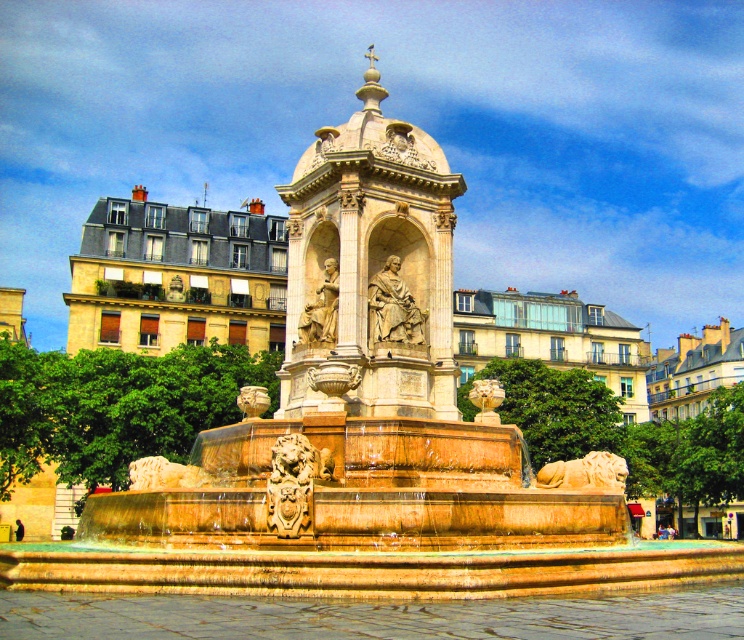
You are standing at the center of the public square and want to approach the carved stone lion at center. According to the image, in which direction should you walk from your current position to reach the lion?

The carved stone lion at center is located at point (295, 483), which is to the lower right of the center position. Therefore, you should walk towards the lower right direction to reach the lion.

You are standing in front of the grand fountain in the public square. There are two points marked on the fountain structure. The first point is at coordinate point (295, 449) and the second is at point (478, 397). Which of these two points is closer to you?

The point at (295, 449) is closer to you than the point at (478, 397).

You are an art student who wants to sketch the fountain. You notice the polished bronze statue at center and the gold polished lion at center. Which one should you focus on first if you want to draw the taller object?

The gold polished lion at center is taller than the polished bronze statue at center, so you should focus on the gold polished lion at center first.